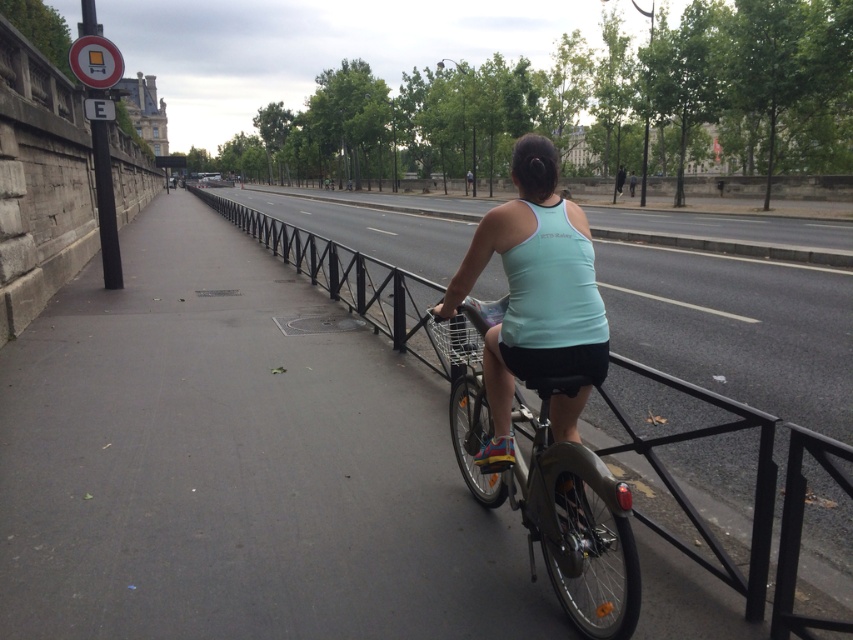
Question: Which is nearer to the metallic silver bicycle at center?

Choices:
 (A) black metal rail at center
 (B) light blue fabric tank top at center

Answer: (B)

Question: Can you confirm if black metal rail at center is positioned above light blue fabric tank top at center?

Choices:
 (A) no
 (B) yes

Answer: (B)

Question: Which of the following is the farthest from the observer?

Choices:
 (A) light blue fabric tank top at center
 (B) metallic silver bicycle at center
 (C) black metal rail at center

Answer: (A)

Question: Which point is closer to the camera?

Choices:
 (A) (563, 316)
 (B) (614, 593)

Answer: (A)

Question: Can you confirm if metallic silver bicycle at center is bigger than light blue fabric tank top at center?

Choices:
 (A) yes
 (B) no

Answer: (A)

Question: Does black metal rail at center have a larger size compared to metallic silver bicycle at center?

Choices:
 (A) no
 (B) yes

Answer: (B)